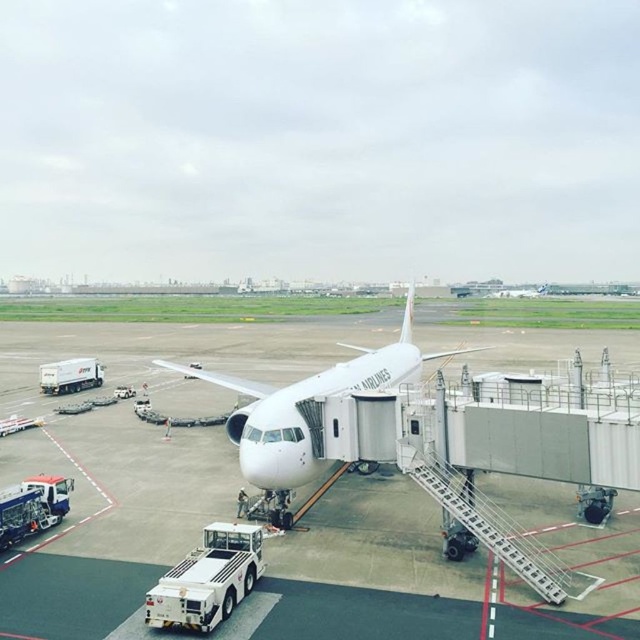
Question: Is white smooth tarmac at center above white glossy airplane at center?

Choices:
 (A) no
 (B) yes

Answer: (A)

Question: Is white smooth tarmac at center positioned at the back of white glossy airplane at center?

Choices:
 (A) no
 (B) yes

Answer: (A)

Question: Can you confirm if white smooth tarmac at center is wider than white glossy airplane at center?

Choices:
 (A) no
 (B) yes

Answer: (B)

Question: Which point is farther to the camera?

Choices:
 (A) (320, 384)
 (B) (273, 378)

Answer: (B)

Question: Which point appears farthest from the camera in this image?

Choices:
 (A) (257, 346)
 (B) (260, 442)

Answer: (A)